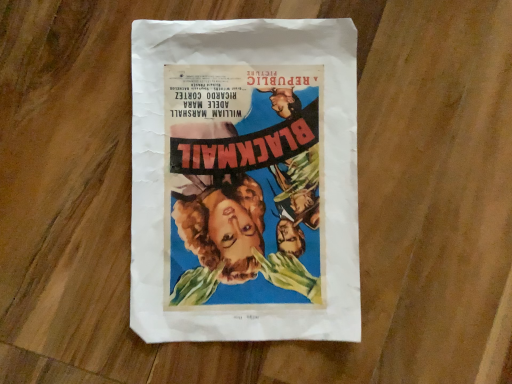
What is the approximate width of vintage paper poster at center?

It is 12.38 inches.

The image size is (512, 384). What do you see at coordinates (244, 181) in the screenshot?
I see `vintage paper poster at center` at bounding box center [244, 181].

Identify the location of vintage paper poster at center. The height and width of the screenshot is (384, 512). 244,181.

You are a GUI agent. You are given a task and a screenshot of the screen. Output one action in this format:
    pyautogui.click(x=<x>, y=<y>)
    Task: Click on the vintage paper poster at center
    
    Given the screenshot: What is the action you would take?
    pyautogui.click(x=244, y=181)